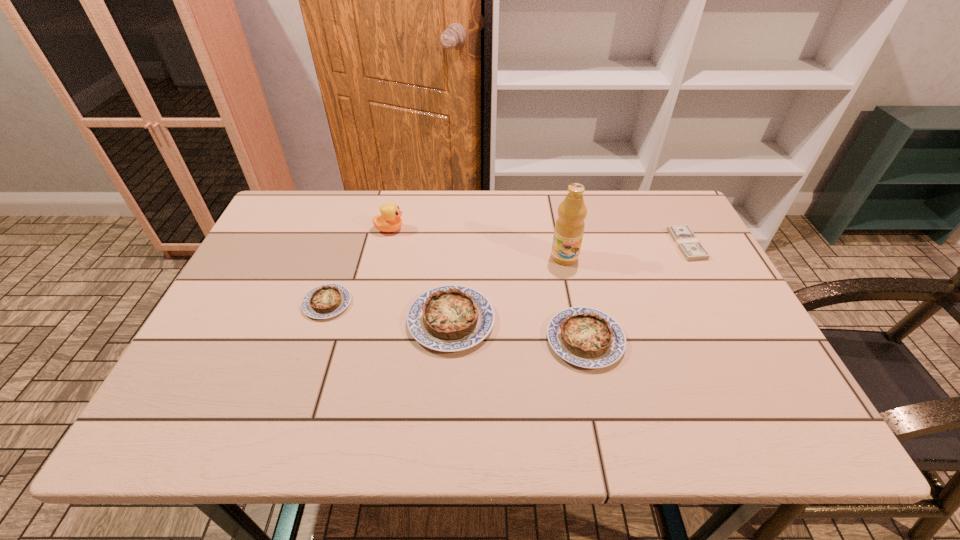
In order to click on the second shortest object in this screenshot , I will do `click(325, 301)`.

Identify the location of the leftmost object. (325, 301).

This screenshot has height=540, width=960. In order to click on the second quiche from left to right in this screenshot , I will do coord(450,318).

Where is `the fourth tallest object`? the fourth tallest object is located at coordinates (586, 337).

Locate an element on the screen. Image resolution: width=960 pixels, height=540 pixels. the second shortest quiche is located at coordinates (586, 337).

Locate an element on the screen. olive oil is located at coordinates (569, 228).

Image resolution: width=960 pixels, height=540 pixels. Find the location of `the rightmost object`. the rightmost object is located at coordinates (x=691, y=248).

Locate an element on the screen. dollar is located at coordinates (691, 248).

Locate an element on the screen. The width and height of the screenshot is (960, 540). the fifth object from right to left is located at coordinates (389, 221).

Image resolution: width=960 pixels, height=540 pixels. I want to click on the second tallest object, so click(389, 221).